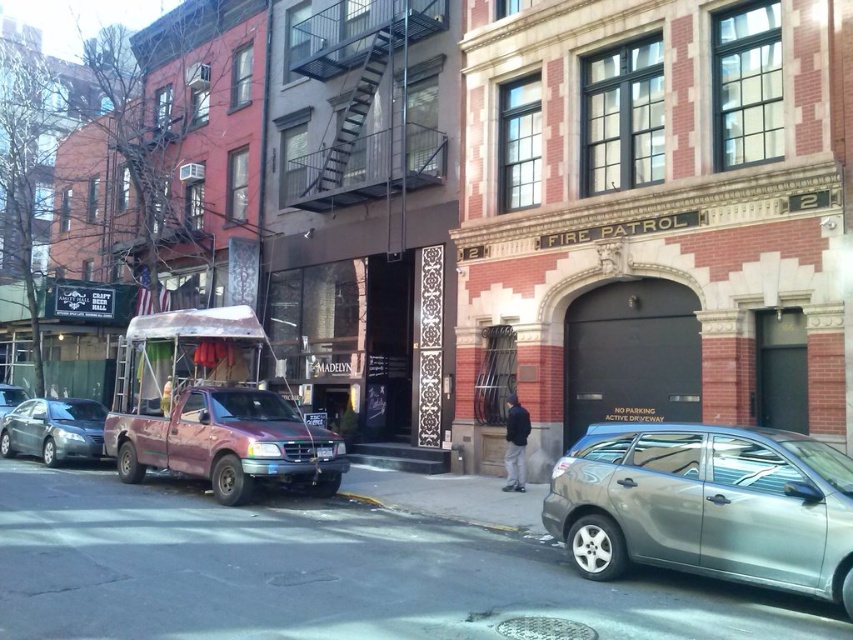
Between point (28, 403) and point (363, 496), which one is positioned in front?

Point (363, 496)

Can you confirm if matte gray sedan at left is positioned to the right of yellow rubber at lower center?

Incorrect, matte gray sedan at left is not on the right side of yellow rubber at lower center.

Who is more distant from viewer, (102, 452) or (469, 524)?

Point (102, 452)

Find the location of a particular element. The height and width of the screenshot is (640, 853). matte gray sedan at left is located at coordinates click(x=53, y=429).

Who is higher up, rusty metal food truck at left or matte gray sedan at left?

rusty metal food truck at left is higher up.

Between rusty metal food truck at left and matte gray sedan at left, which one has more height?

rusty metal food truck at left is taller.

The width and height of the screenshot is (853, 640). What are the coordinates of `rusty metal food truck at left` in the screenshot? It's located at (210, 408).

Identify the location of dark gray jacket at center. (515, 444).

Find the location of `dark gray jacket at center`. dark gray jacket at center is located at coordinates (515, 444).

Where is `dark gray jacket at center`? This screenshot has height=640, width=853. dark gray jacket at center is located at coordinates (515, 444).